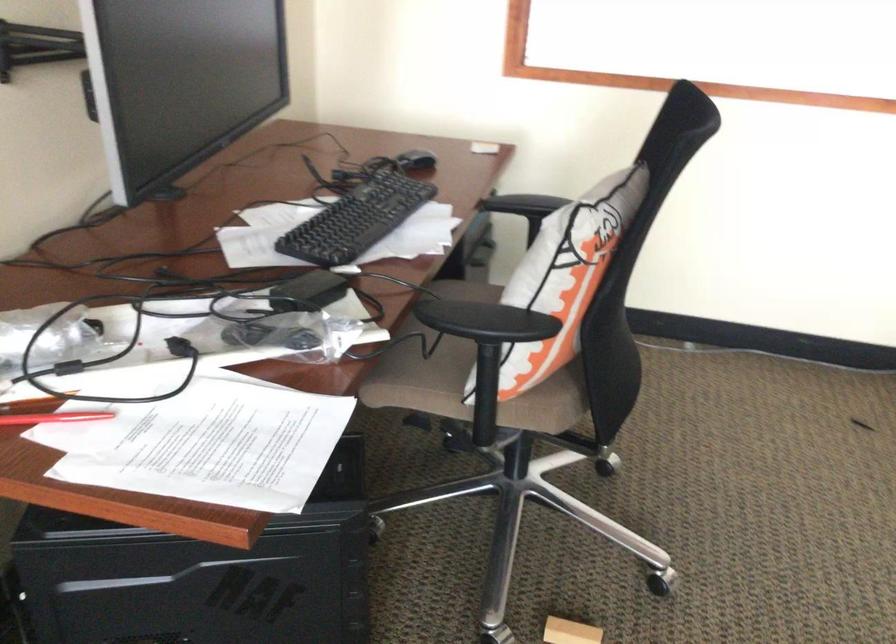
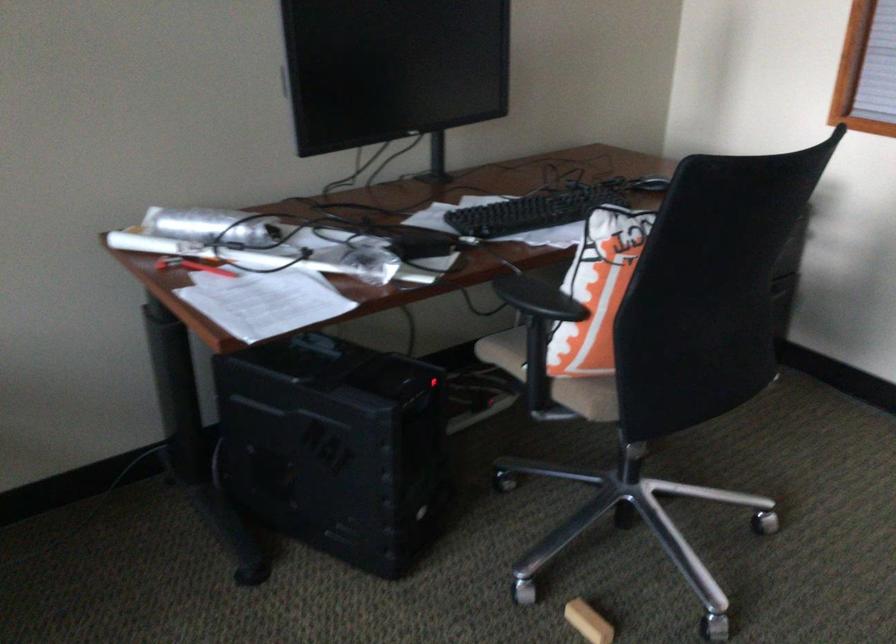
The point at (x=509, y=321) is marked in the first image. Where is the corresponding point in the second image?

(538, 299)